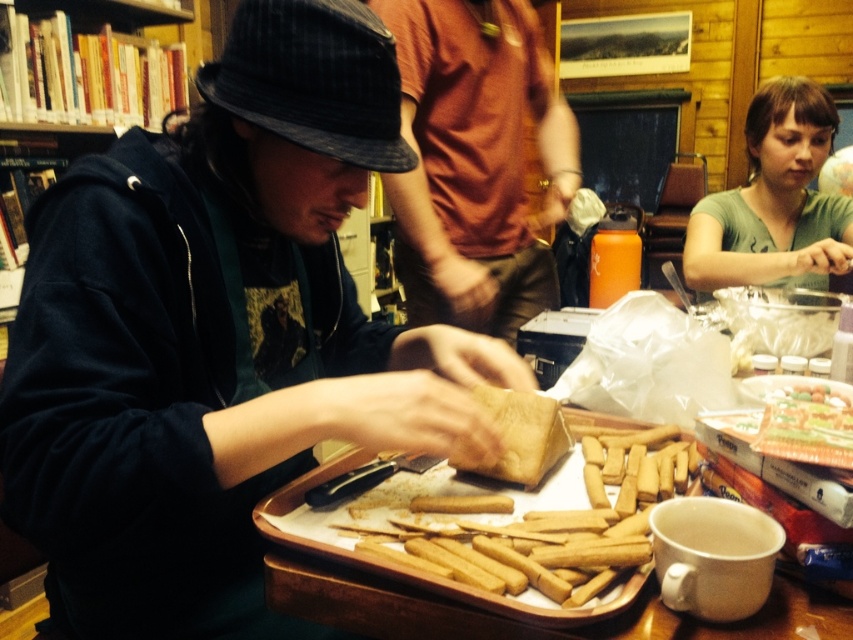
You are a GUI agent. You are given a task and a screenshot of the screen. Output one action in this format:
    pyautogui.click(x=<x>, y=<y>)
    Task: Click on the matte black hat at center
    
    Given the screenshot: What is the action you would take?
    pyautogui.click(x=218, y=333)

Can you confirm if matte black hat at center is positioned to the left of golden brown bread at center?

Indeed, matte black hat at center is positioned on the left side of golden brown bread at center.

The height and width of the screenshot is (640, 853). What do you see at coordinates (218, 333) in the screenshot?
I see `matte black hat at center` at bounding box center [218, 333].

You are a GUI agent. You are given a task and a screenshot of the screen. Output one action in this format:
    pyautogui.click(x=<x>, y=<y>)
    Task: Click on the matte black hat at center
    
    Given the screenshot: What is the action you would take?
    pyautogui.click(x=218, y=333)

Looking at this image, who is positioned more to the right, green matte shirt at upper right or golden brown bread at center?

green matte shirt at upper right

Can you confirm if green matte shirt at upper right is positioned to the left of golden brown bread at center?

In fact, green matte shirt at upper right is to the right of golden brown bread at center.

Describe the element at coordinates (775, 200) in the screenshot. I see `green matte shirt at upper right` at that location.

In order to click on green matte shirt at upper right in this screenshot , I will do `click(775, 200)`.

Is matte black hat at center below matte orange shirt at center?

Yes, matte black hat at center is below matte orange shirt at center.

Who is more distant from viewer, [123,467] or [525,10]?

Point [525,10]

Find the location of a particular element. The width and height of the screenshot is (853, 640). matte black hat at center is located at coordinates (218, 333).